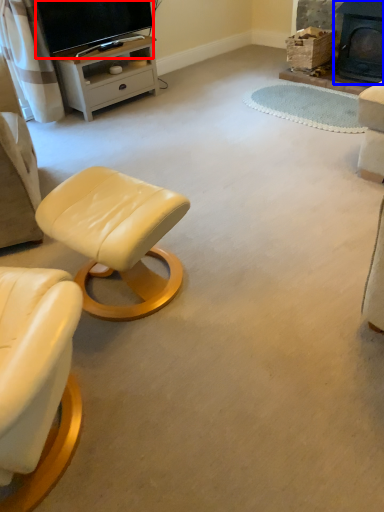
Question: Which object is closer to the camera taking this photo, television (highlighted by a red box) or fireplace (highlighted by a blue box)?

Choices:
 (A) television
 (B) fireplace

Answer: (A)